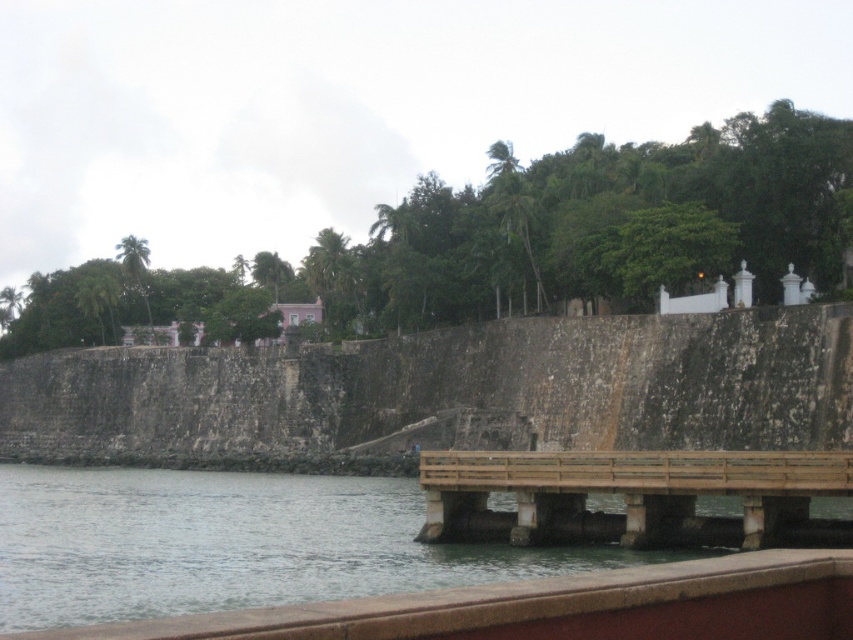
You are a photographer planning to capture the waterfront scene. You want to ensure both the clear water at lower left and the brown wooden dock at lower center are visible in your shot. Which object should you focus on first to frame the composition properly?

The clear water at lower left is bigger than the brown wooden dock at lower center, so you should focus on the clear water at lower left first to ensure it occupies the appropriate space in the frame before adjusting for the smaller dock.

You are standing at the edge of the waterfront scene and want to walk from the clear water at lower left to the brown wooden dock at lower center. Which direction should you move to reach the dock?

You should move towards the dock by going to the right, as the clear water at lower left is in front of the brown wooden dock at lower center, meaning the dock is behind the water from your perspective.